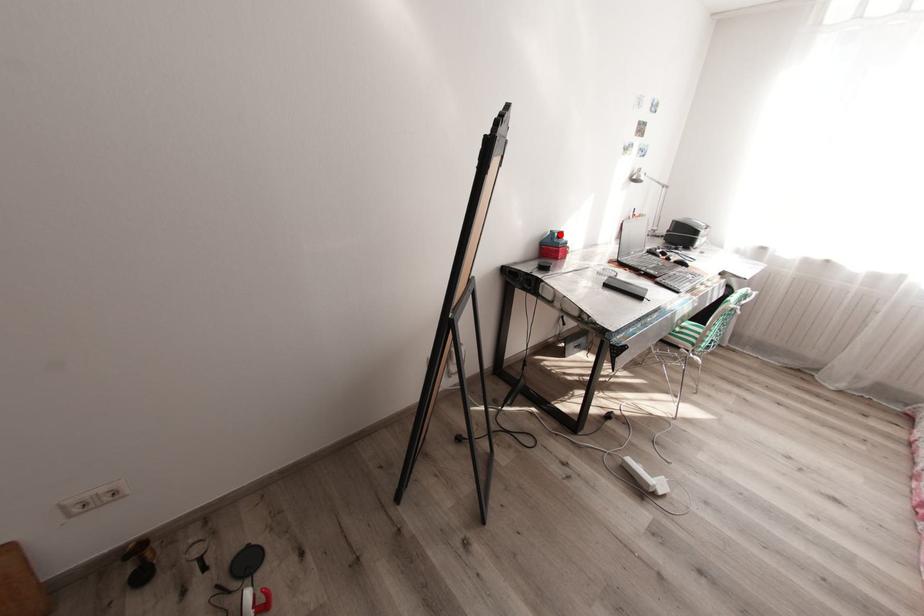
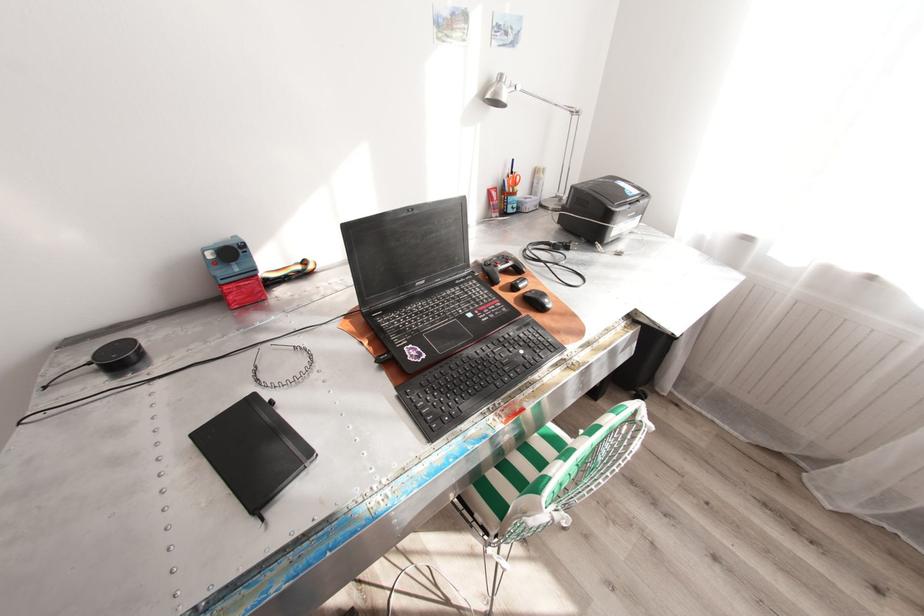
In the second image, find the point that corresponds to the highlighted location in the first image.

(215, 254)